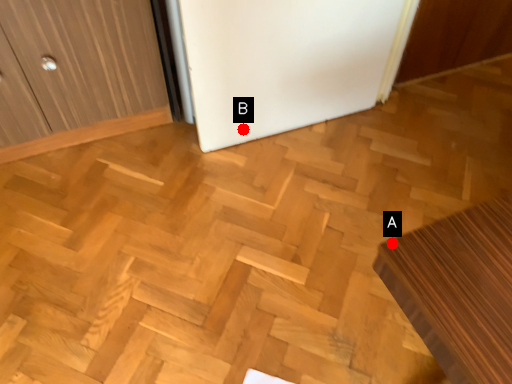
Question: Two points are circled on the image, labeled by A and B beside each circle. Which point is further to the camera?

Choices:
 (A) A is further
 (B) B is further

Answer: (B)